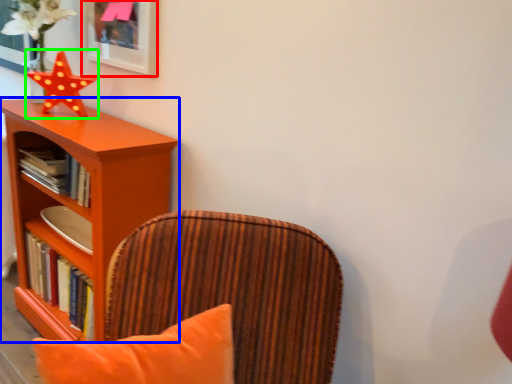
Question: Which object is the farthest from picture frame (highlighted by a red box)? Choose among these: shelf (highlighted by a blue box) or star (highlighted by a green box).

Choices:
 (A) shelf
 (B) star

Answer: (A)